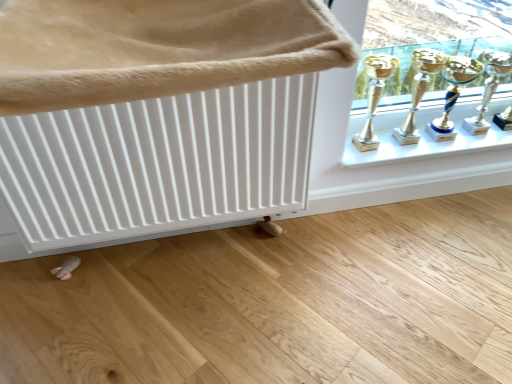
Locate an element on the screen. The height and width of the screenshot is (384, 512). free region under white matte radiator at upper left (from a real-world perspective) is located at coordinates click(193, 246).